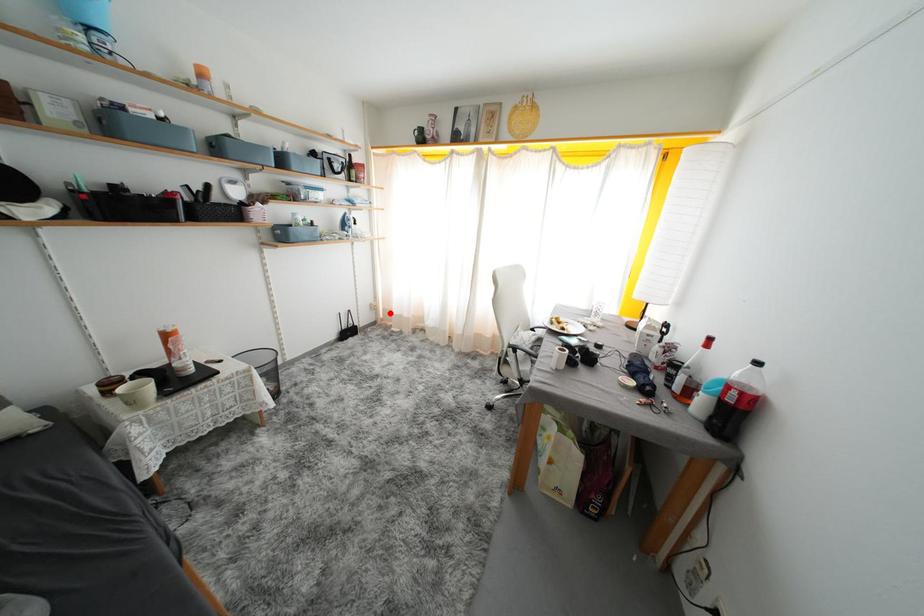
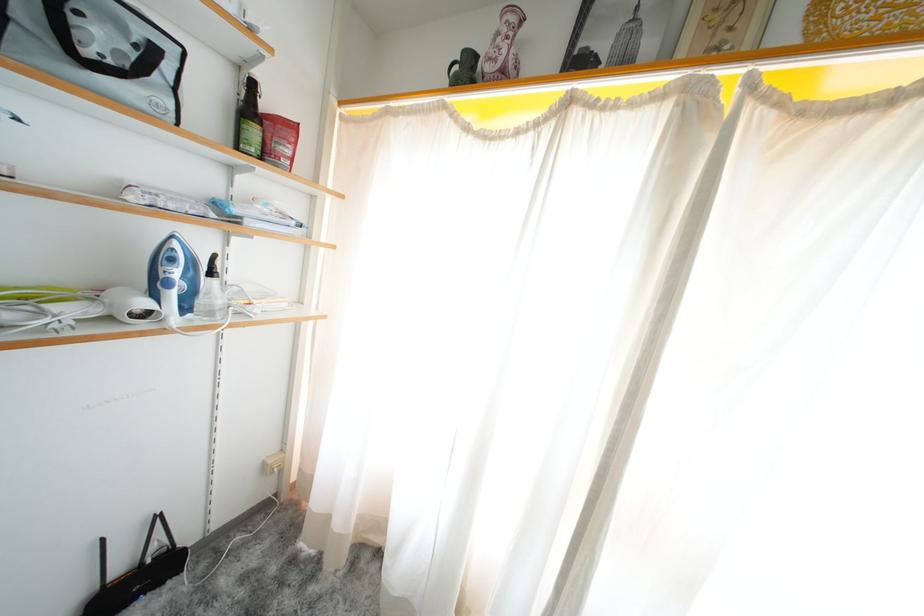
Question: I am providing you with two images of the same scene from different viewpoints. A red point is shown in image1. For the corresponding object point in image2, is it positioned nearer or farther from the camera?

Choices:
 (A) Nearer
 (B) Farther

Answer: (B)